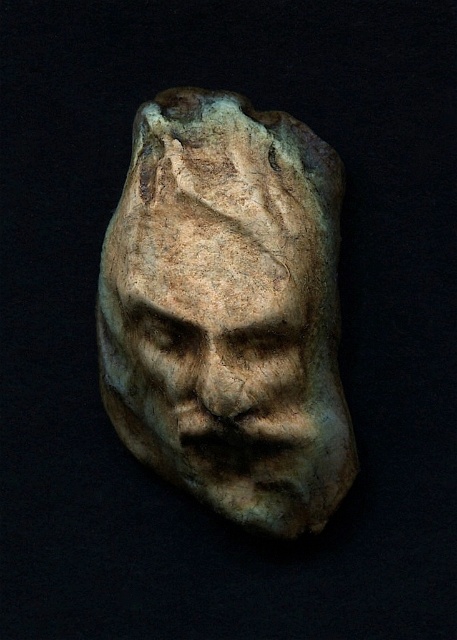
Is matte stone face at center to the right of rough stone face at center from the viewer's perspective?

In fact, matte stone face at center is to the left of rough stone face at center.

Is point (134, 348) closer to camera compared to point (245, 385)?

No, (134, 348) is further to viewer.

Is point (190, 353) behind point (203, 413)?

That is True.

Identify the location of matte stone face at center. (228, 310).